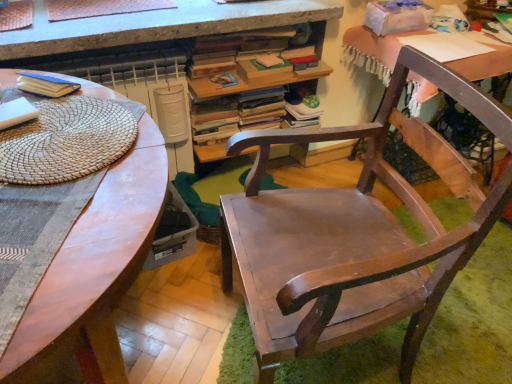
Question: Is wooden chair at center to the right of matte blue paperback book at upper left from the viewer's perspective?

Choices:
 (A) yes
 (B) no

Answer: (A)

Question: Is the surface of wooden chair at center in direct contact with matte blue paperback book at upper left?

Choices:
 (A) yes
 (B) no

Answer: (B)

Question: Does wooden chair at center come behind matte blue paperback book at upper left?

Choices:
 (A) no
 (B) yes

Answer: (A)

Question: Can you confirm if wooden chair at center is bigger than matte blue paperback book at upper left?

Choices:
 (A) yes
 (B) no

Answer: (A)

Question: Would you say wooden chair at center is a long distance from matte blue paperback book at upper left?

Choices:
 (A) no
 (B) yes

Answer: (A)

Question: From the image's perspective, is wooden book at upper center positioned above or below wooden chair at center?

Choices:
 (A) above
 (B) below

Answer: (A)

Question: Visually, is wooden book at upper center positioned to the left or to the right of wooden chair at center?

Choices:
 (A) right
 (B) left

Answer: (B)

Question: Is wooden book at upper center inside the boundaries of wooden chair at center, or outside?

Choices:
 (A) outside
 (B) inside

Answer: (A)

Question: From a real-world perspective, is wooden book at upper center positioned above or below wooden chair at center?

Choices:
 (A) above
 (B) below

Answer: (A)

Question: Relative to wooden chair at center, is matte wooden desk at center, which is the 1th desk from left to right, in front or behind?

Choices:
 (A) behind
 (B) front

Answer: (B)

Question: Looking at their shapes, would you say matte wooden desk at center, which is the 1th desk from left to right, is wider or thinner than wooden chair at center?

Choices:
 (A) wide
 (B) thin

Answer: (A)

Question: From their relative heights in the image, would you say matte wooden desk at center, which is the 2th desk in right-to-left order, is taller or shorter than wooden chair at center?

Choices:
 (A) short
 (B) tall

Answer: (A)

Question: Does point (139, 135) appear closer or farther from the camera than point (273, 221)?

Choices:
 (A) farther
 (B) closer

Answer: (B)

Question: Looking at their shapes, would you say wooden desk at upper right, the 1th desk in the right-to-left sequence, is wider or thinner than matte blue paperback book at upper left?

Choices:
 (A) wide
 (B) thin

Answer: (A)

Question: In the image, is wooden desk at upper right, the 1th desk in the right-to-left sequence, positioned in front of or behind matte blue paperback book at upper left?

Choices:
 (A) front
 (B) behind

Answer: (B)